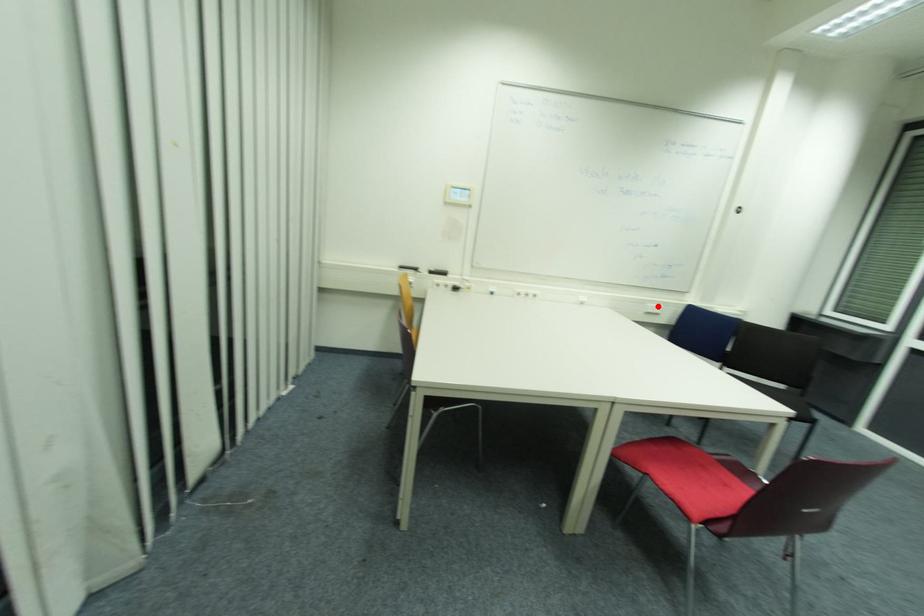
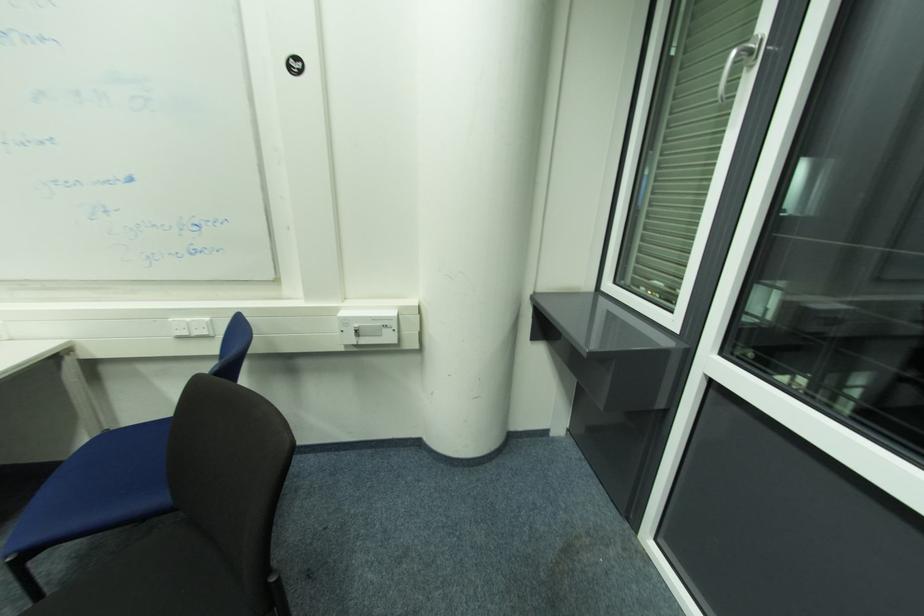
Question: A red point is marked in image1. In image2, is the corresponding 3D point closer to the camera or farther? Reply with the corresponding letter.

Choices:
 (A) The corresponding 3D point is closer.
 (B) The corresponding 3D point is farther.

Answer: (B)